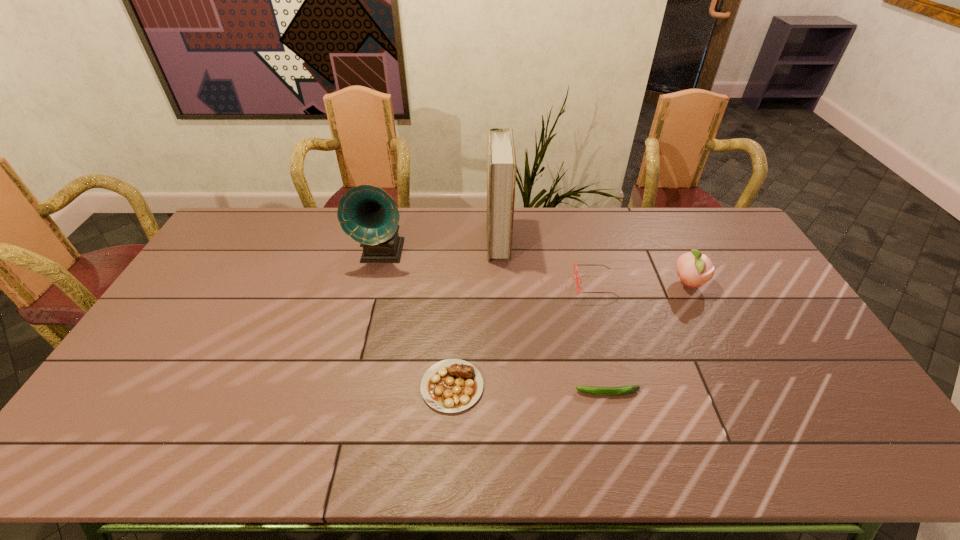
Where is `the fourth object from right to left`? the fourth object from right to left is located at coordinates (501, 161).

You are a GUI agent. You are given a task and a screenshot of the screen. Output one action in this format:
    pyautogui.click(x=<x>, y=<y>)
    Task: Click on the phonebook
    This screenshot has height=540, width=960.
    Given the screenshot: What is the action you would take?
    pyautogui.click(x=501, y=161)

What are the coordinates of `the second tallest object` in the screenshot? It's located at (369, 215).

The image size is (960, 540). In order to click on phonograph_record in this screenshot , I will do click(x=369, y=215).

I want to click on the fourth shortest object, so click(x=694, y=269).

This screenshot has width=960, height=540. What are the coordinates of `the rightmost object` in the screenshot? It's located at (694, 269).

Where is `the third shortest object`? the third shortest object is located at coordinates (574, 264).

You are a GUI agent. You are given a task and a screenshot of the screen. Output one action in this format:
    pyautogui.click(x=<x>, y=<y>)
    Task: Click on the steak
    This screenshot has width=960, height=540.
    Given the screenshot: What is the action you would take?
    pyautogui.click(x=452, y=385)

Identify the location of the fifth tallest object. Image resolution: width=960 pixels, height=540 pixels. (452, 385).

The height and width of the screenshot is (540, 960). What are the coordinates of `zucchini` in the screenshot? It's located at (623, 390).